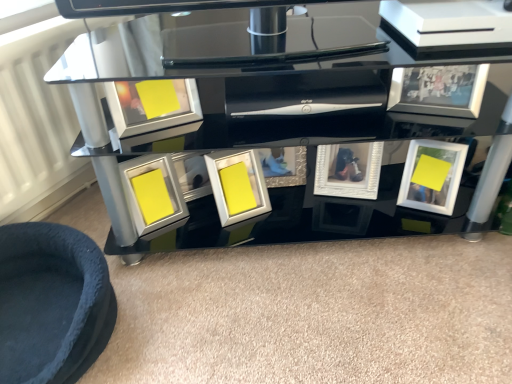
I want to click on free space in front of matte yellow picture frame at center, the 1th picture frame viewed from the left, so click(164, 279).